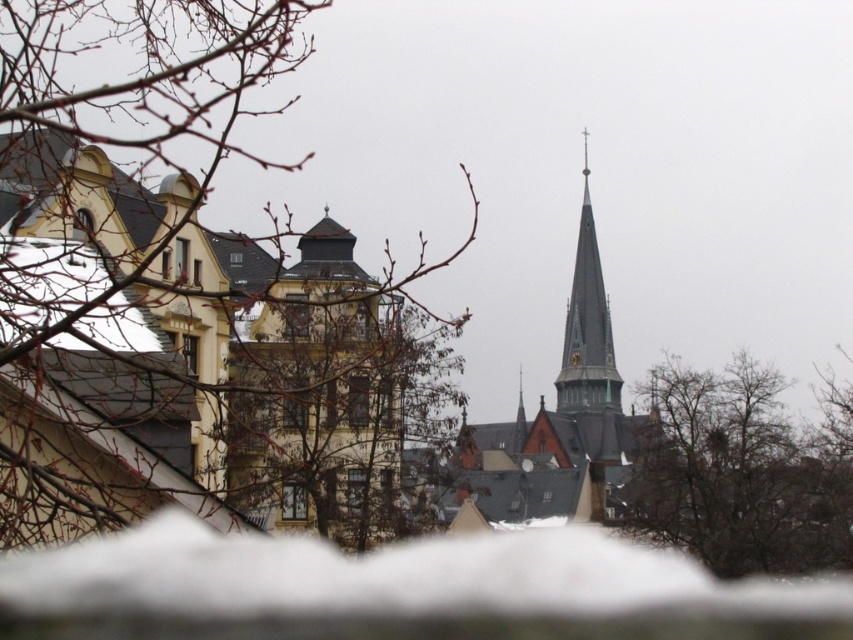
You are standing in the winter scene and want to take a photo of the brown leafless tree at lower right and the smooth gray steeple at center. Which object should you focus on to ensure both are in the frame without moving the camera?

The brown leafless tree at lower right is shorter than the smooth gray steeple at center, so focusing on the steeple will ensure both are in the frame as the tree is lower and shorter.

You are standing in the winter scene and notice the white fluffy snow at lower center and the brown leafless tree at lower right. Which object covers a larger area in the image?

The white fluffy snow at lower center is bigger than the brown leafless tree at lower right, so it covers a larger area in the image.

You are standing at the center of the image and want to walk towards the brown leafless tree at lower right. In which direction should you move?

The brown leafless tree at lower right is located at coordinates point (740, 474), so you should move towards the lower right direction to reach it.